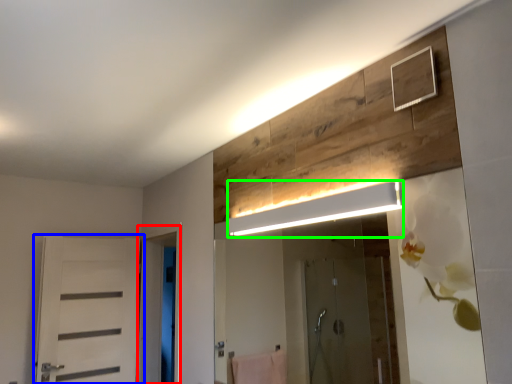
Question: Estimate the real-world distances between objects in this image. Which object is farther from screen door (highlighted by a red box), door (highlighted by a blue box) or light fixture (highlighted by a green box)?

Choices:
 (A) door
 (B) light fixture

Answer: (B)